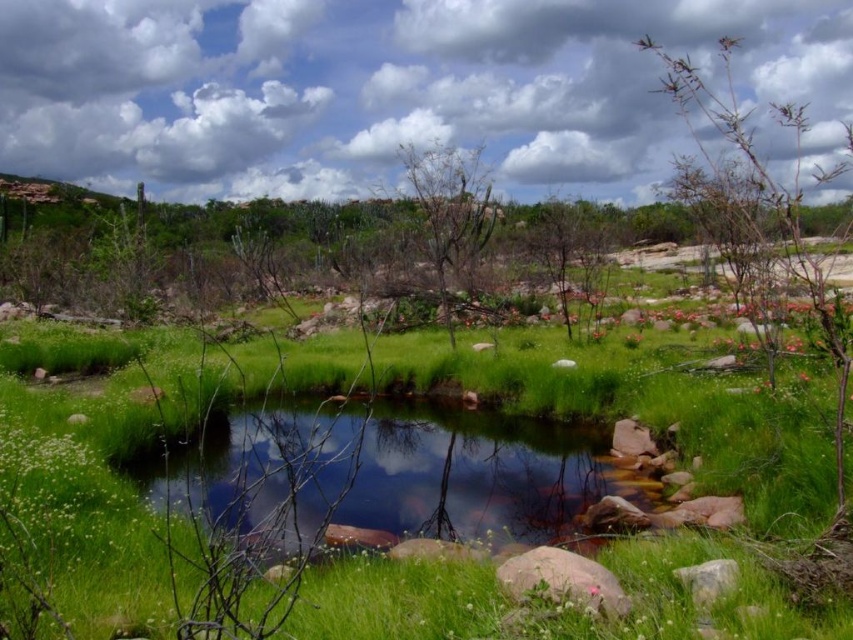
Who is positioned more to the left, clear water at center or gray rough rock at lower right?

From the viewer's perspective, clear water at center appears more on the left side.

Is clear water at center smaller than gray rough rock at lower right?

Actually, clear water at center might be larger than gray rough rock at lower right.

Locate an element on the screen. clear water at center is located at coordinates (392, 476).

The height and width of the screenshot is (640, 853). I want to click on clear water at center, so click(392, 476).

Between bare branches at upper right and bare branches at center, which one is positioned higher?

bare branches at upper right is above.

Can you confirm if bare branches at upper right is smaller than bare branches at center?

Actually, bare branches at upper right might be larger than bare branches at center.

Which is in front, point (735, 120) or point (456, 188)?

Point (735, 120) is in front.

Where is `bare branches at upper right`? bare branches at upper right is located at coordinates (770, 200).

Does point (285, 422) come closer to viewer compared to point (561, 200)?

Yes, it is.

From the picture: Is green grass at center thinner than green leafy tree at center?

Indeed, green grass at center has a lesser width compared to green leafy tree at center.

Which is behind, point (579, 365) or point (582, 269)?

Positioned behind is point (582, 269).

The width and height of the screenshot is (853, 640). Identify the location of green grass at center. (268, 476).